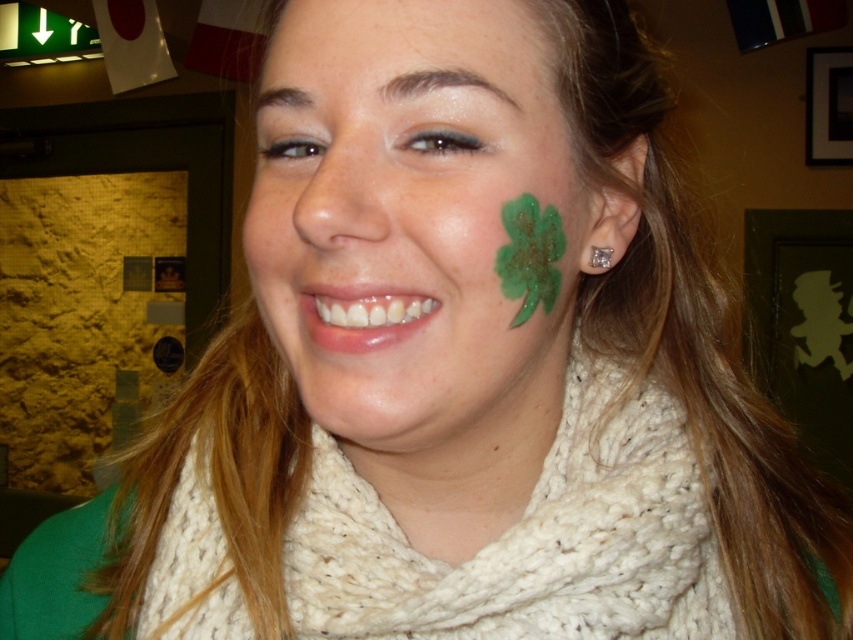
Can you confirm if green glittery shamrock at right is taller than white knitted scarf at center?

Yes.

What do you see at coordinates (410, 220) in the screenshot? This screenshot has height=640, width=853. I see `green glittery shamrock at right` at bounding box center [410, 220].

Who is more forward, (317, 321) or (190, 492)?

Point (317, 321) is in front.

At what (x,y) coordinates should I click in order to perform the action: click on green glittery shamrock at right. Please return your answer as a coordinate pair (x, y). Looking at the image, I should click on (410, 220).

Which is more to the left, green glittery shamrock at right or clear crystal earring at ear?

green glittery shamrock at right

Is green glittery shamrock at right wider than clear crystal earring at ear?

Correct, the width of green glittery shamrock at right exceeds that of clear crystal earring at ear.

I want to click on green glittery shamrock at right, so coord(410,220).

Does white knitted scarf at center have a lesser height compared to clear crystal earring at ear?

In fact, white knitted scarf at center may be taller than clear crystal earring at ear.

Who is shorter, white knitted scarf at center or clear crystal earring at ear?

With less height is clear crystal earring at ear.

Find the location of a particular element. Image resolution: width=853 pixels, height=640 pixels. white knitted scarf at center is located at coordinates (525, 538).